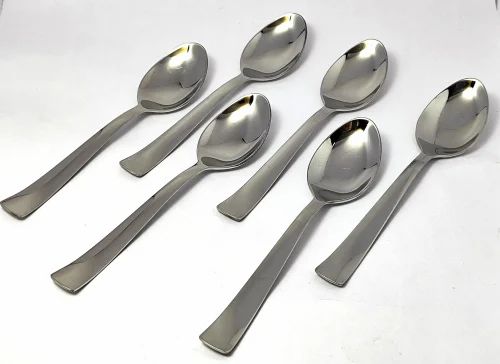
Locate an element on the screen. The height and width of the screenshot is (364, 500). spoons is located at coordinates (275, 49), (185, 83), (260, 123), (377, 75), (341, 157), (457, 131).